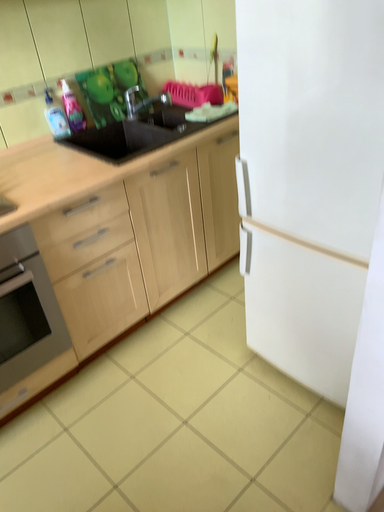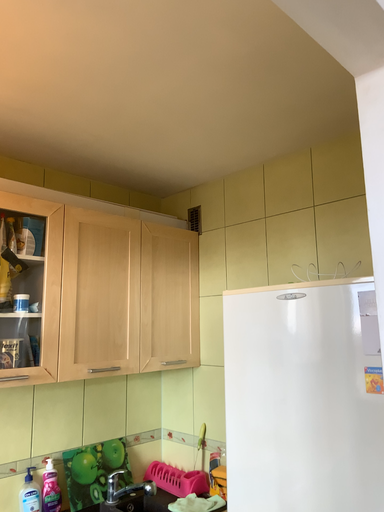
Question: How did the camera likely rotate when shooting the video?

Choices:
 (A) rotated downward
 (B) rotated upward

Answer: (B)